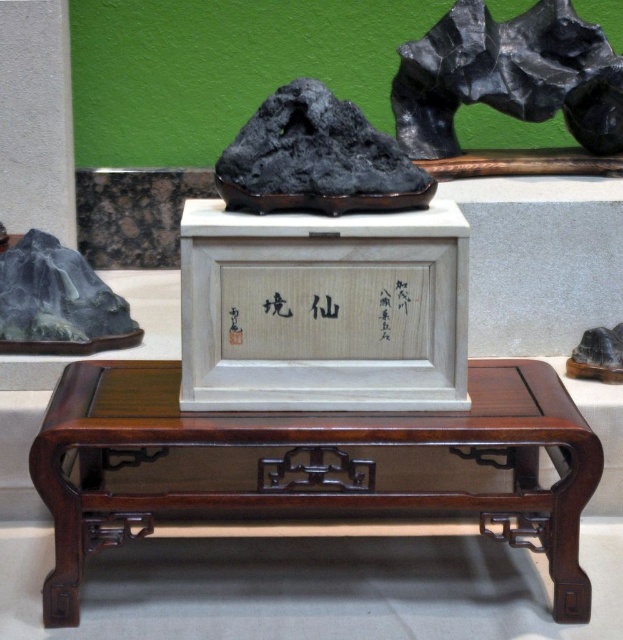
Question: Among these objects, which one is nearest to the camera?

Choices:
 (A) mahogany wood table at center
 (B) black stone sculpture at upper center
 (C) matte black rock at left
 (D) matte black rock at right

Answer: (A)

Question: Which of the following is the closest to the observer?

Choices:
 (A) (55, 333)
 (B) (300, 106)
 (C) (472, 440)
 (D) (566, 372)

Answer: (C)

Question: Is mahogany wood table at center above matte black rock at right?

Choices:
 (A) no
 (B) yes

Answer: (A)

Question: Does black stone sculpture at upper center lie in front of matte black rock at right?

Choices:
 (A) no
 (B) yes

Answer: (A)

Question: Can you confirm if mahogany wood table at center is positioned to the right of matte black rock at left?

Choices:
 (A) yes
 (B) no

Answer: (A)

Question: Which object is positioned farthest from the mahogany wood table at center?

Choices:
 (A) black stone sculpture at upper center
 (B) matte black rock at right

Answer: (A)